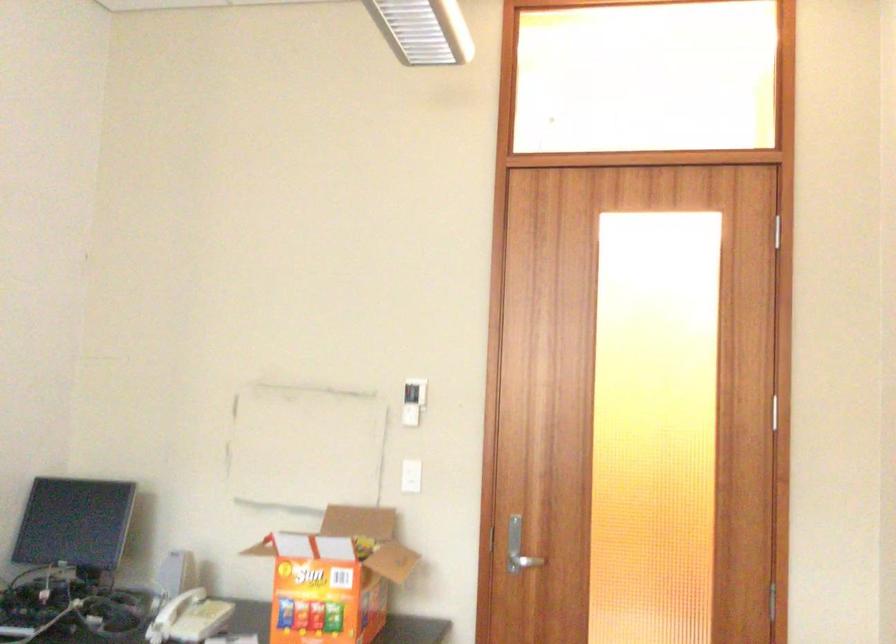
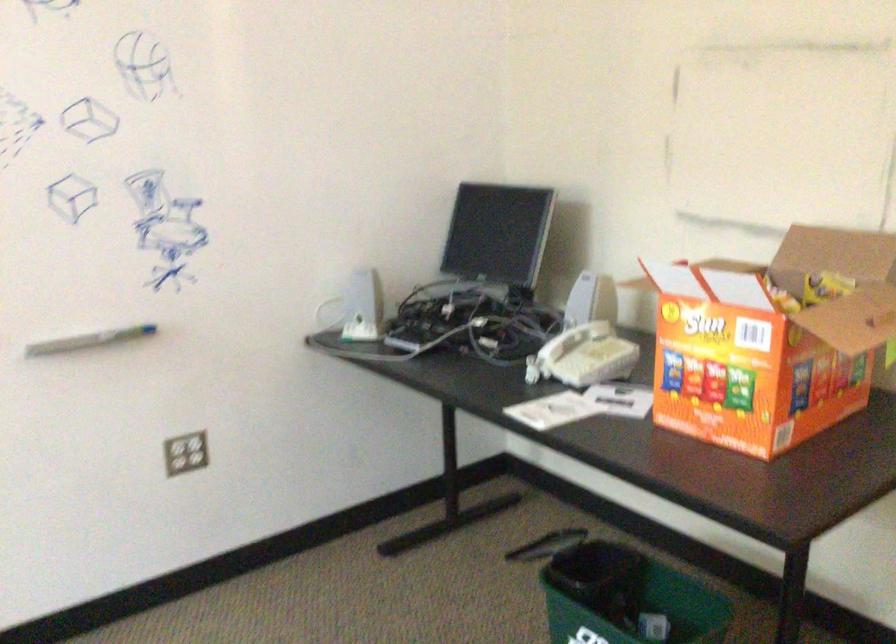
Find the pixel in the second image that matches point (364, 547) in the first image.

(824, 287)